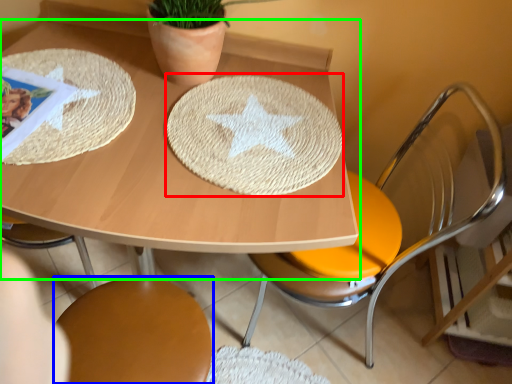
Question: Which object is positioned closest to plate (highlighted by a red box)? Select from chair (highlighted by a blue box) and table (highlighted by a green box).

Choices:
 (A) chair
 (B) table

Answer: (B)